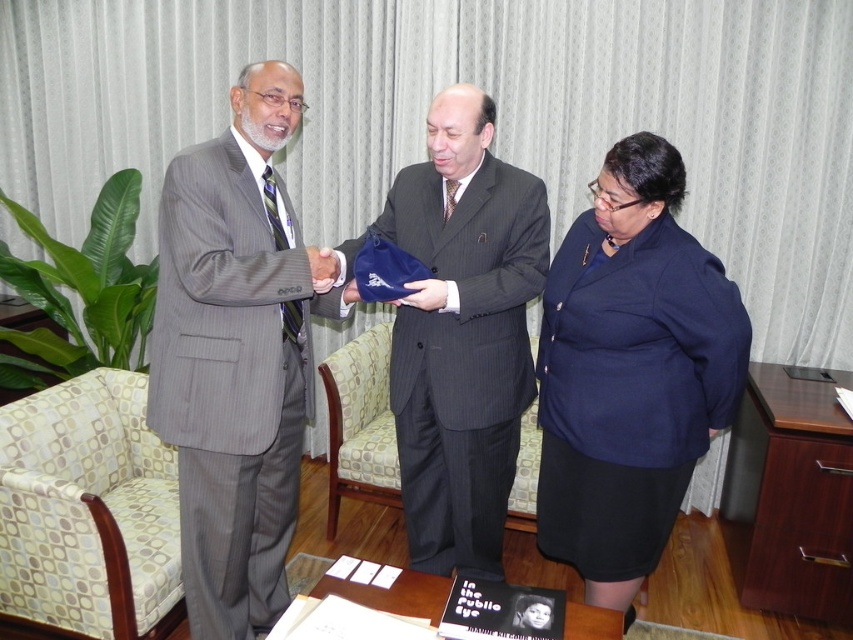
Question: Can you confirm if navy blue wool skirt at lower right is positioned to the right of gray pinstripe armchair at center?

Choices:
 (A) yes
 (B) no

Answer: (A)

Question: Which object is closer to the camera taking this photo?

Choices:
 (A) navy blue wool skirt at lower right
 (B) pinstriped suit at center
 (C) matte black suit at center

Answer: (C)

Question: Which of these objects is positioned closest to the patterned fabric armchair at left?

Choices:
 (A) gray pinstripe armchair at center
 (B) matte black suit at center

Answer: (B)

Question: Estimate the real-world distances between objects in this image. Which object is closer to the gray pinstripe armchair at center?

Choices:
 (A) pinstriped suit at center
 (B) matte black suit at center
 (C) navy blue wool skirt at lower right
 (D) patterned fabric armchair at left

Answer: (A)

Question: Does matte black suit at center lie in front of gray pinstripe armchair at center?

Choices:
 (A) yes
 (B) no

Answer: (A)

Question: Is pinstriped suit at center to the left of gray pinstripe armchair at center from the viewer's perspective?

Choices:
 (A) no
 (B) yes

Answer: (A)